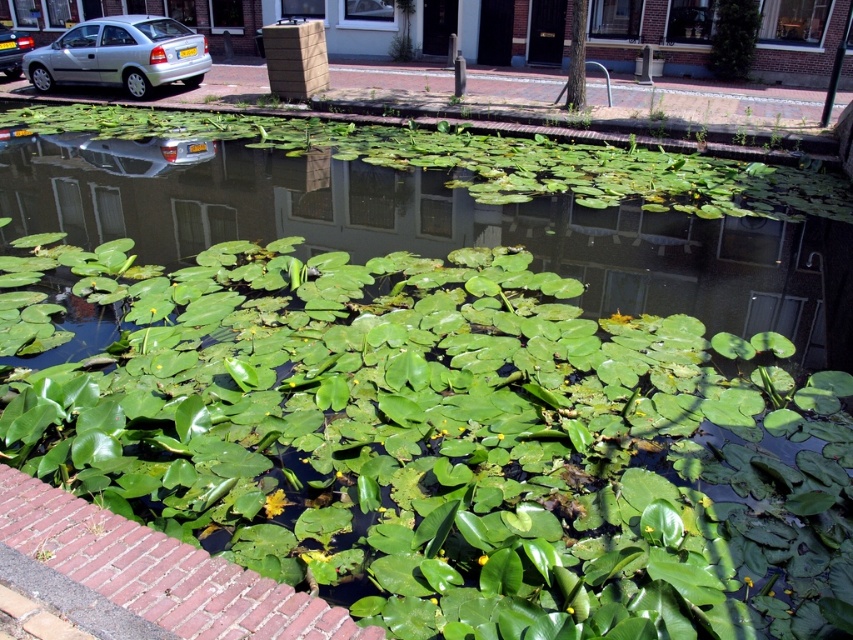
Who is positioned more to the left, green leafy plant at center or matte silver car at left?

Positioned to the left is matte silver car at left.

Can you confirm if green leafy plant at center is taller than matte silver car at left?

Yes, green leafy plant at center is taller than matte silver car at left.

Locate an element on the screen. green leafy plant at center is located at coordinates (448, 444).

Which is behind, point (705, 596) or point (128, 81)?

The point (128, 81) is more distant.

Is green leafy plant at center above silver metallic car at upper left?

No.

Which is behind, point (10, 372) or point (83, 38)?

Point (83, 38)

The image size is (853, 640). I want to click on green leafy plant at center, so click(448, 444).

Who is lower down, silver metallic car at upper left or matte silver car at left?

silver metallic car at upper left is lower down.

Who is more distant from viewer, (108, 77) or (0, 54)?

Point (0, 54)

Identify the location of silver metallic car at upper left. (120, 54).